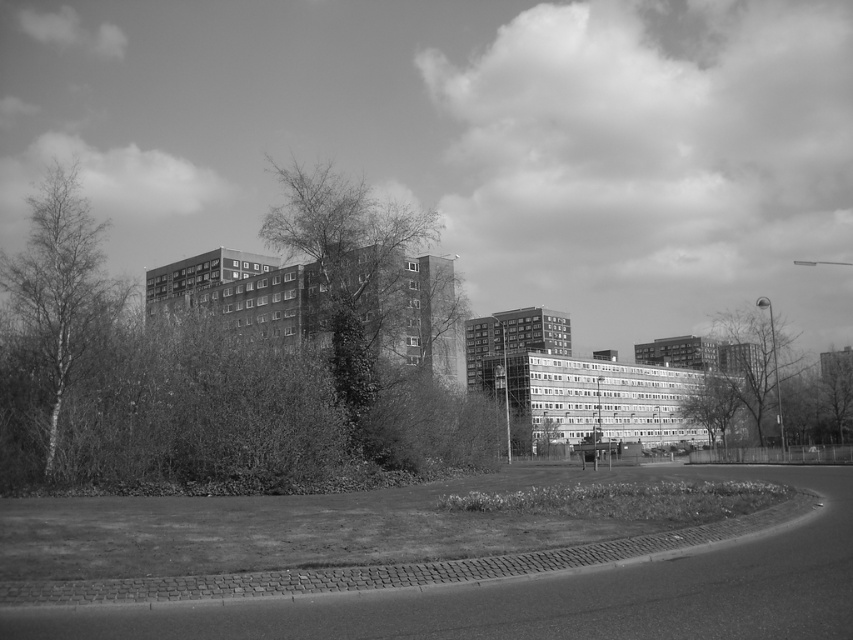
Question: Does thick textured foliage at center appear over bare birch tree at left?

Choices:
 (A) yes
 (B) no

Answer: (B)

Question: Among these points, which one is farthest from the camera?

Choices:
 (A) (308, 170)
 (B) (62, 193)

Answer: (A)

Question: Does thick textured foliage at center appear under bare birch tree at left?

Choices:
 (A) no
 (B) yes

Answer: (B)

Question: From the image, what is the correct spatial relationship of thick textured foliage at center in relation to bare birch tree at left?

Choices:
 (A) below
 (B) above

Answer: (A)